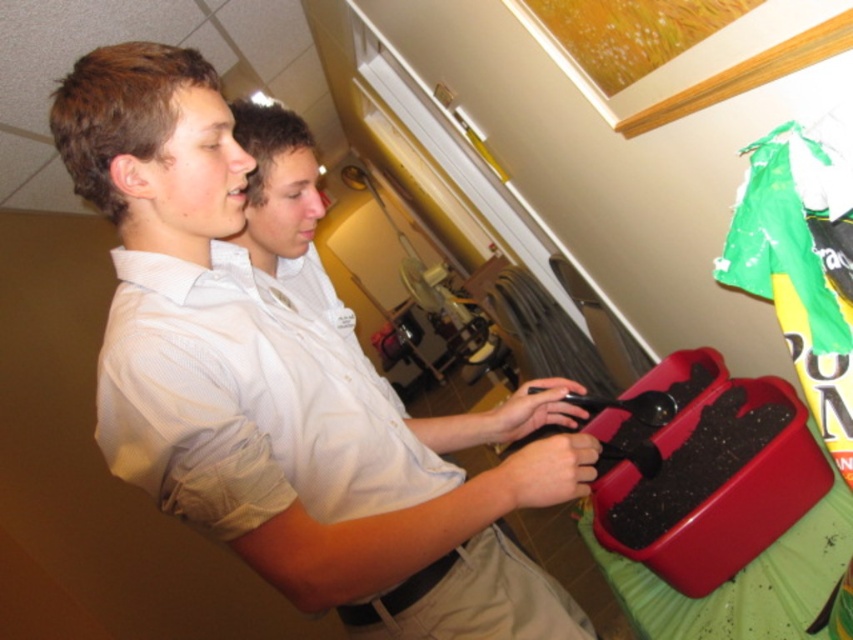
Question: Which of the following is the farthest from the observer?

Choices:
 (A) (439, 634)
 (B) (399, 611)
 (C) (225, 337)

Answer: (B)

Question: Can you confirm if white cotton shirt at center is thinner than khaki cotton pants at lower center?

Choices:
 (A) no
 (B) yes

Answer: (A)

Question: Considering the real-world distances, which object is closest to the white matte shirt at center?

Choices:
 (A) khaki cotton pants at lower center
 (B) white cotton shirt at center

Answer: (B)

Question: Estimate the real-world distances between objects in this image. Which object is closer to the white cotton shirt at center?

Choices:
 (A) white matte shirt at center
 (B) khaki cotton pants at lower center

Answer: (A)

Question: In this image, where is white matte shirt at center located relative to white cotton shirt at center?

Choices:
 (A) above
 (B) below

Answer: (B)

Question: Does white matte shirt at center have a lesser width compared to white cotton shirt at center?

Choices:
 (A) no
 (B) yes

Answer: (A)